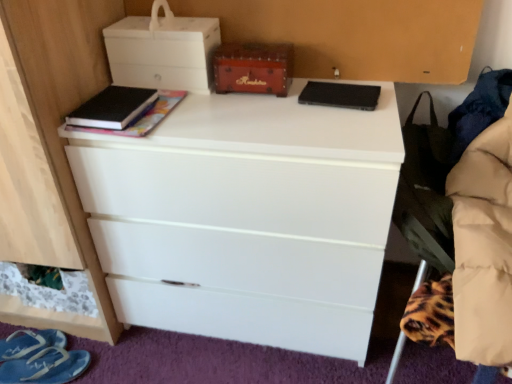
Question: Would you say black matte book at upper left, acting as the 2th book starting from the right, is inside or outside blue fabric sandal at lower left, the first footwear positioned from the back?

Choices:
 (A) outside
 (B) inside

Answer: (A)

Question: From a real-world perspective, is black matte book at upper left, which ranks as the first book in left-to-right order, positioned above or below blue fabric sandal at lower left, which ranks as the 2th footwear in front-to-back order?

Choices:
 (A) above
 (B) below

Answer: (A)

Question: Which object is the closest to the black fabric swivel chair at right?

Choices:
 (A) wooden chest at center, placed as the 1th storage box when sorted from right to left
 (B) white matte storage box at upper left, positioned as the second storage box in right-to-left order
 (C) black matte book at upper left, acting as the 2th book starting from the right
 (D) blue fabric slipper at lower left, positioned as the 2th footwear in back-to-front order
 (E) black matte speaker at upper center, placed as the first book when sorted from right to left

Answer: (E)

Question: Based on their relative distances, which object is farther from the blue fabric sandal at lower left, the first footwear positioned from the back?

Choices:
 (A) black matte speaker at upper center, placed as the first book when sorted from right to left
 (B) black fabric swivel chair at right
 (C) white matte storage box at upper left, which is counted as the first storage box, starting from the left
 (D) blue fabric slipper at lower left, positioned as the 2th footwear in back-to-front order
 (E) wooden chest at center, marked as the second storage box in a left-to-right arrangement

Answer: (B)